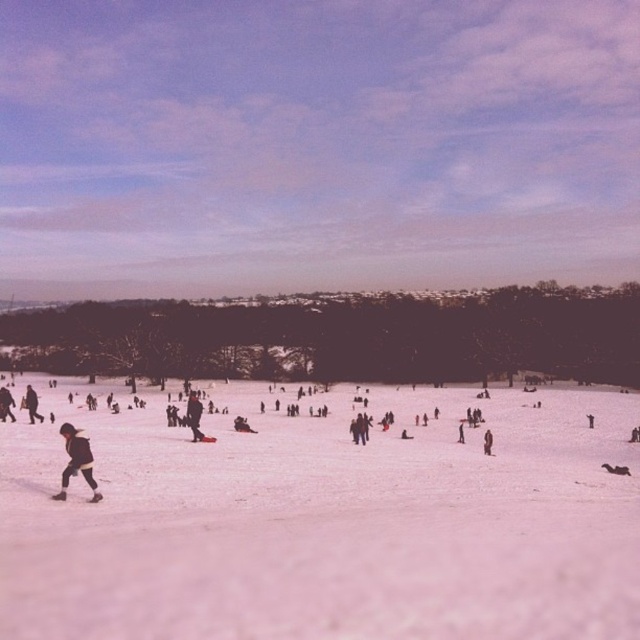
Question: Is the position of dark brown jacket at lower left more distant than that of dark brown leather jacket at lower left?

Choices:
 (A) no
 (B) yes

Answer: (A)

Question: Which object appears closest to the camera in this image?

Choices:
 (A) dark blue jacket at center
 (B) white snow at center
 (C) black matte jacket at center
 (D) dark brown jacket at lower left

Answer: (B)

Question: Does dark blue jacket at center appear on the right side of dark brown leather jacket at lower left?

Choices:
 (A) no
 (B) yes

Answer: (B)

Question: Which point is farther to the camera?

Choices:
 (A) (490, 435)
 (B) (88, 452)
 (C) (35, 408)

Answer: (C)

Question: Is dark brown jacket at lower left smaller than dark blue jacket at center?

Choices:
 (A) yes
 (B) no

Answer: (B)

Question: Which object appears farthest from the camera in this image?

Choices:
 (A) black matte jacket at center
 (B) brown woolen coat at center
 (C) dark brown leather jacket at lower left
 (D) white snow at center

Answer: (C)